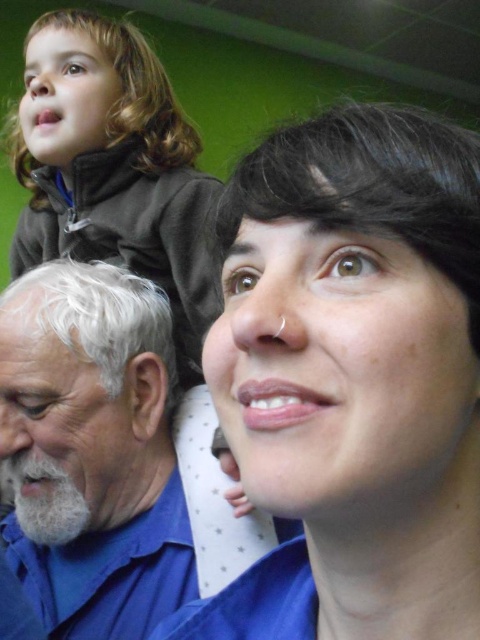
Based on the scene description, where is the matte blue shirt at center located in relation to the dark brown fleece at upper left?

The matte blue shirt at center is to the right of the dark brown fleece at upper left.

You are standing in a room with a green wall. You see a matte blue shirt at center and a gray beard at left. Which object is closer to the ceiling?

The gray beard at left is closer to the ceiling because it is taller than the matte blue shirt at center.